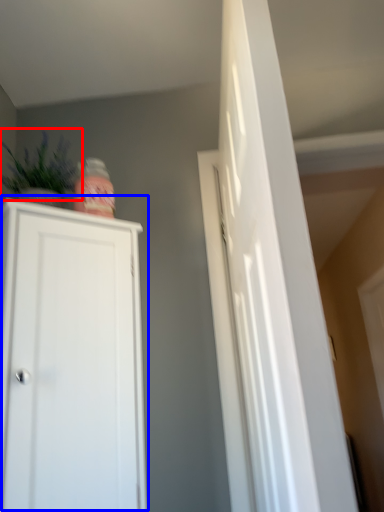
Question: Among these objects, which one is nearest to the camera, plant (highlighted by a red box) or cupboard (highlighted by a blue box)?

Choices:
 (A) plant
 (B) cupboard

Answer: (B)